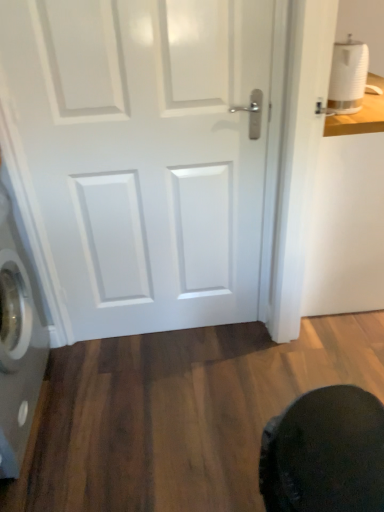
The height and width of the screenshot is (512, 384). Identify the location of blank space situated above dark fabric swivel chair at lower right (from a real-world perspective). (334, 437).